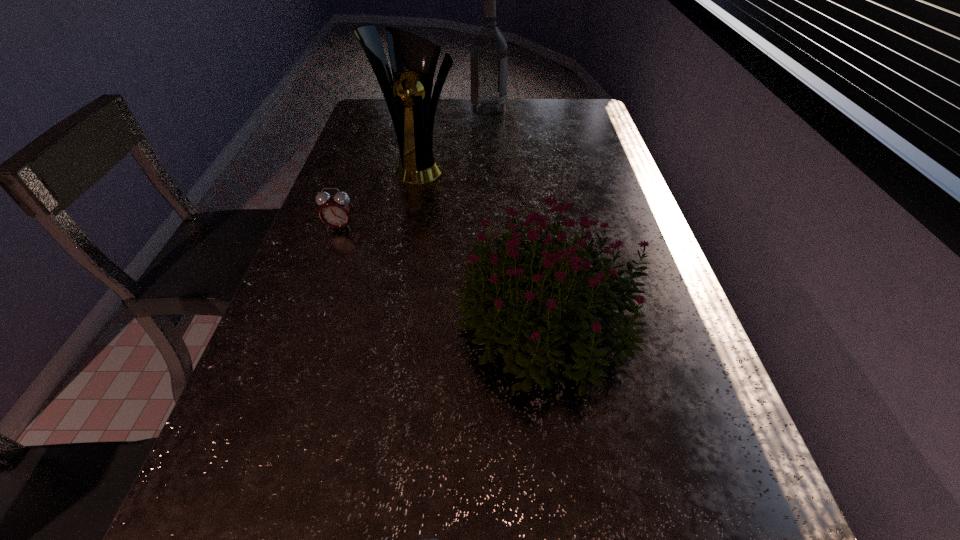
You are a GUI agent. You are given a task and a screenshot of the screen. Output one action in this format:
    pyautogui.click(x=<x>, y=<y>)
    Task: Click on the liquor
    
    Given the screenshot: What is the action you would take?
    pyautogui.click(x=488, y=48)

Where is `award`? Image resolution: width=960 pixels, height=540 pixels. award is located at coordinates (413, 59).

At what (x,y) coordinates should I click in order to perform the action: click on the second nearest object. Please return your answer as a coordinate pair (x, y). The height and width of the screenshot is (540, 960). Looking at the image, I should click on (530, 331).

Identify the location of the third tallest object. This screenshot has height=540, width=960. pos(530,331).

Identify the location of the leftmost object. Image resolution: width=960 pixels, height=540 pixels. (336, 210).

Where is `the third nearest object`? The width and height of the screenshot is (960, 540). the third nearest object is located at coordinates (336, 210).

Locate an element on the screen. The width and height of the screenshot is (960, 540). free space located on the front-facing side of the liquor is located at coordinates (403, 109).

This screenshot has width=960, height=540. Identify the location of vacant space located 0.140m on the front-facing side of the liquor. (433, 109).

At what (x,y) coordinates should I click in order to perform the action: click on vacant position located 0.130m on the front-facing side of the liquor. Please return your answer as a coordinate pair (x, y). The image size is (960, 540). Looking at the image, I should click on (436, 109).

The image size is (960, 540). In order to click on free spot located 0.060m at the front of the award, where the globe is visible in this screenshot , I will do `click(413, 197)`.